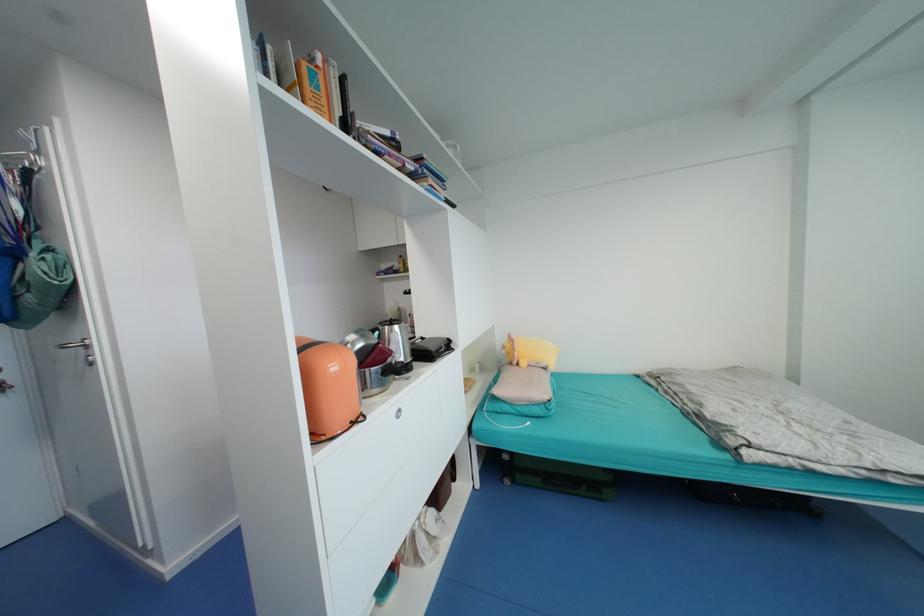
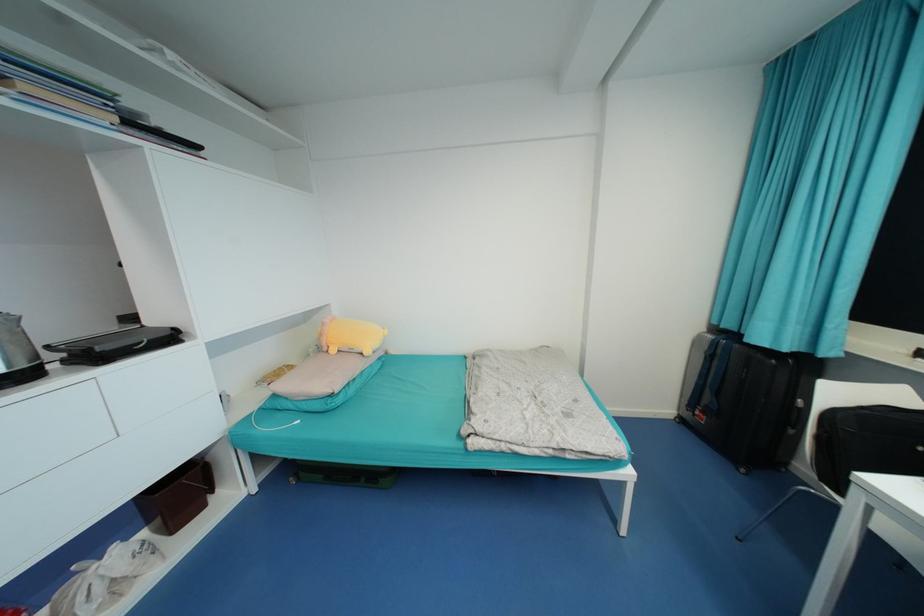
Where in the second image is the point corresponding to (517,350) from the first image?

(325, 334)